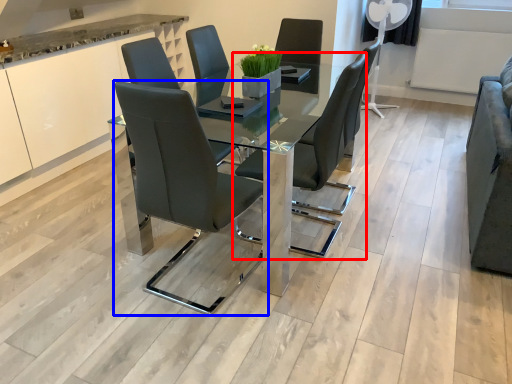
Question: Which object is further to the camera taking this photo, chair (highlighted by a red box) or chair (highlighted by a blue box)?

Choices:
 (A) chair
 (B) chair

Answer: (A)